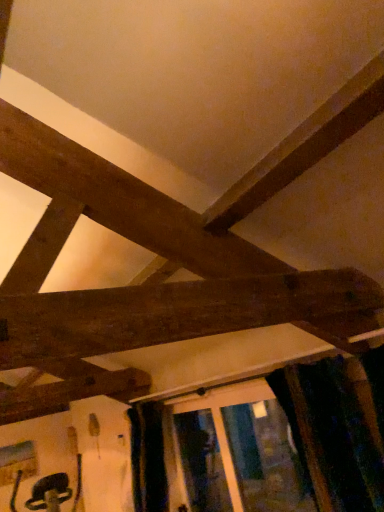
I want to click on dark wood window frame at upper center, so click(247, 447).

What do you see at coordinates (247, 447) in the screenshot? The width and height of the screenshot is (384, 512). I see `dark wood window frame at upper center` at bounding box center [247, 447].

This screenshot has width=384, height=512. Find the location of `dark wood window frame at upper center`. dark wood window frame at upper center is located at coordinates [x=247, y=447].